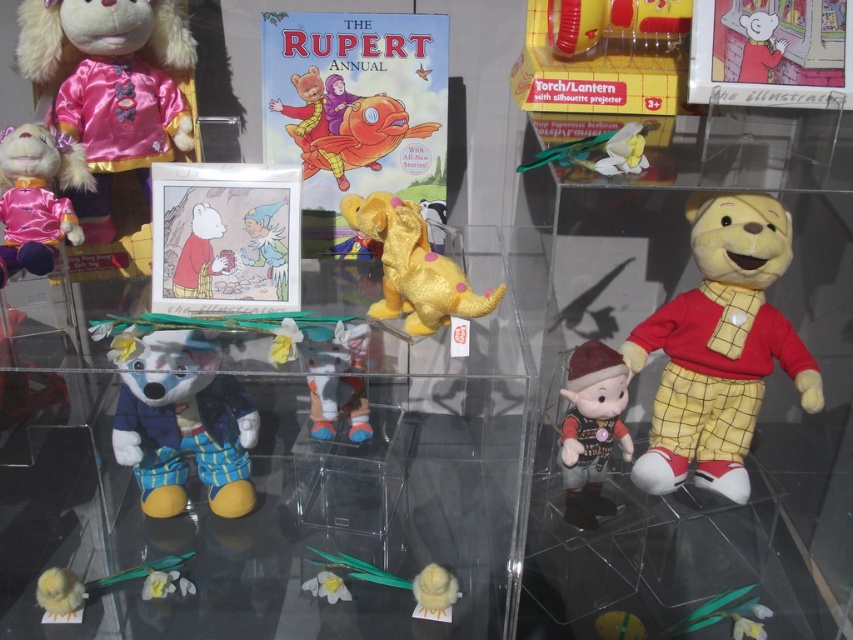
Is point (3, 172) in front of point (320, 381)?

Yes, point (3, 172) is in front of point (320, 381).

Identify the location of silky pink plush at left. (36, 196).

Is white plush mouse at lower left shorter than silky pink plush at left?

No, white plush mouse at lower left is not shorter than silky pink plush at left.

Does white plush mouse at lower left have a greater height compared to silky pink plush at left?

Yes.

Identify the location of white plush mouse at lower left. Image resolution: width=853 pixels, height=640 pixels. (183, 422).

Can you confirm if yellow plush winnie the pooh at right is wider than silky pink plush at left?

Indeed, yellow plush winnie the pooh at right has a greater width compared to silky pink plush at left.

Consider the image. Measure the distance between point (762,230) and camera.

The distance of point (762,230) from camera is 3.36 feet.

This screenshot has width=853, height=640. What do you see at coordinates (718, 348) in the screenshot?
I see `yellow plush winnie the pooh at right` at bounding box center [718, 348].

The image size is (853, 640). I want to click on yellow plush winnie the pooh at right, so click(x=718, y=348).